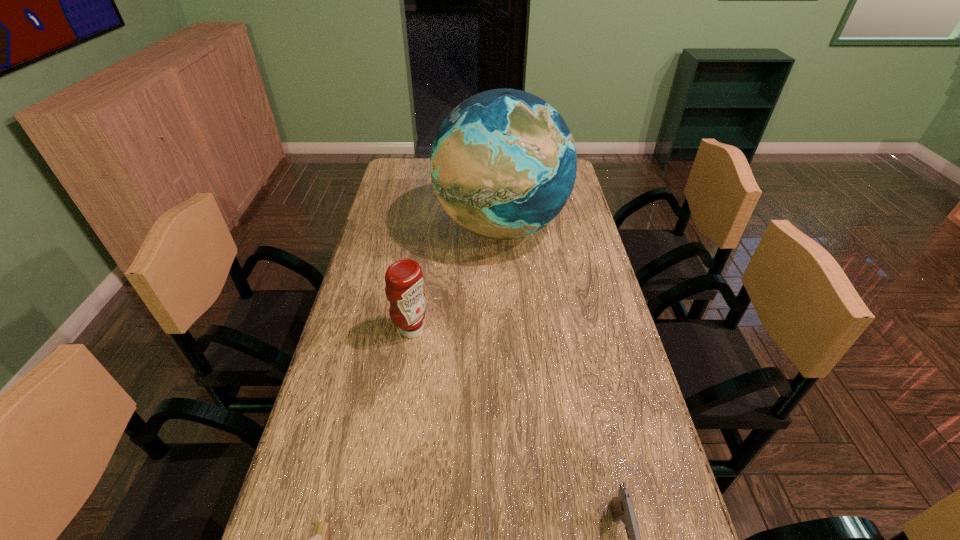
At what (x,y) coordinates should I click in order to perform the action: click on free space at the far left corner. Please return your answer as a coordinate pair (x, y). Looking at the image, I should click on pyautogui.click(x=416, y=160).

In order to click on object that ranks as the third closest to the escargot in this screenshot , I will do `click(503, 163)`.

Identify which object is the second nearest to the tallest object. Please provide its 2D coordinates. Your answer should be formatted as a tuple, i.e. [(x, y)], where the tuple contains the x and y coordinates of a point satisfying the conditions above.

[(622, 508)]